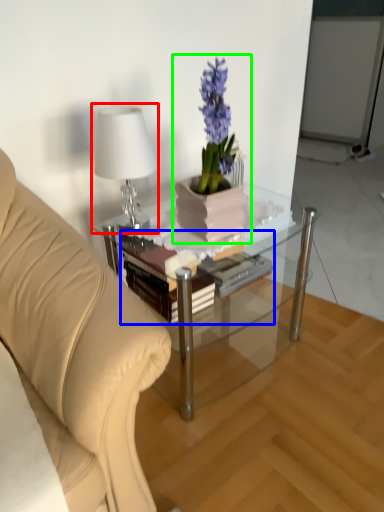
Question: Which is farther away from table lamp (highlighted by a red box)? book (highlighted by a blue box) or houseplant (highlighted by a green box)?

Choices:
 (A) book
 (B) houseplant

Answer: (A)